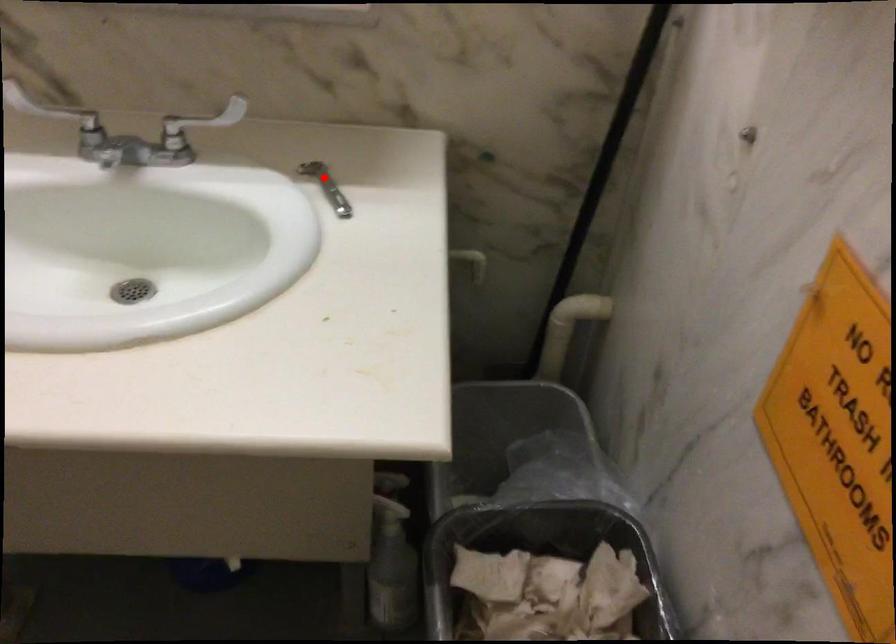
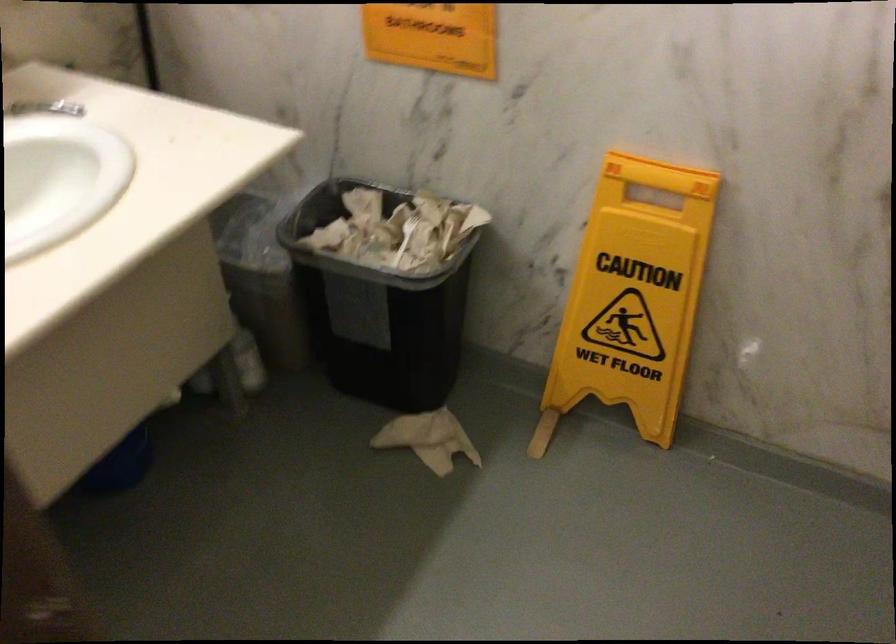
Where in the second image is the point corresponding to the highlighted location from the first image?

(45, 108)